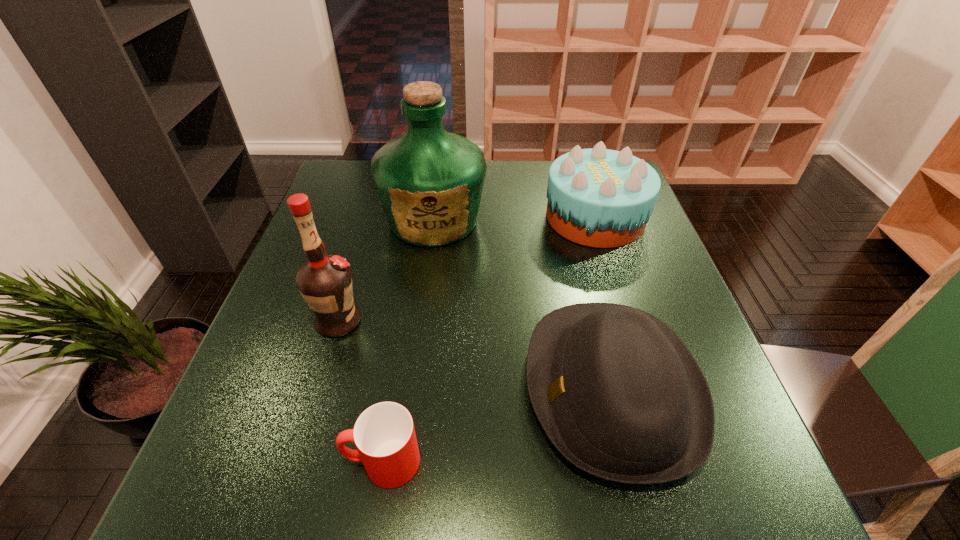
Identify the location of empty space between the farther liquor and the fedora. Image resolution: width=960 pixels, height=540 pixels. (523, 303).

I want to click on vacant area between the cake and the cup, so click(x=489, y=340).

Find the location of a particular element. This screenshot has width=960, height=540. vacant area that lies between the fedora and the cake is located at coordinates (604, 302).

Image resolution: width=960 pixels, height=540 pixels. I want to click on free spot between the farther liquor and the fedora, so click(x=523, y=303).

Where is `free space between the cup and the farther liquor`? This screenshot has width=960, height=540. free space between the cup and the farther liquor is located at coordinates pos(408,341).

Where is `vacant space that's between the cup and the fedora`? The image size is (960, 540). vacant space that's between the cup and the fedora is located at coordinates (497, 425).

Where is `free point between the fedora and the shortest object`? free point between the fedora and the shortest object is located at coordinates (497, 425).

You are a GUI agent. You are given a task and a screenshot of the screen. Output one action in this format:
    pyautogui.click(x=<x>, y=<y>)
    Task: Click on the free point between the cake and the cup
    This screenshot has height=540, width=960.
    Given the screenshot: What is the action you would take?
    pyautogui.click(x=489, y=340)

Where is `object that stands as the fourth closest to the farther liquor`? The image size is (960, 540). object that stands as the fourth closest to the farther liquor is located at coordinates (384, 434).

Point out which object is positioned as the fourth nearest to the fedora. Please provide its 2D coordinates. Your answer should be formatted as a tuple, i.e. [(x, y)], where the tuple contains the x and y coordinates of a point satisfying the conditions above.

[(324, 281)]